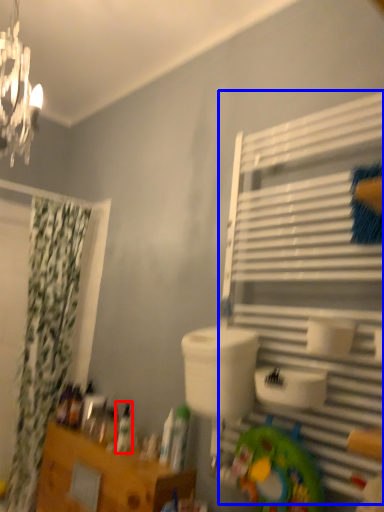
Question: Which object is further to the camera taking this photo, toiletry (highlighted by a red box) or shelf (highlighted by a blue box)?

Choices:
 (A) toiletry
 (B) shelf

Answer: (A)